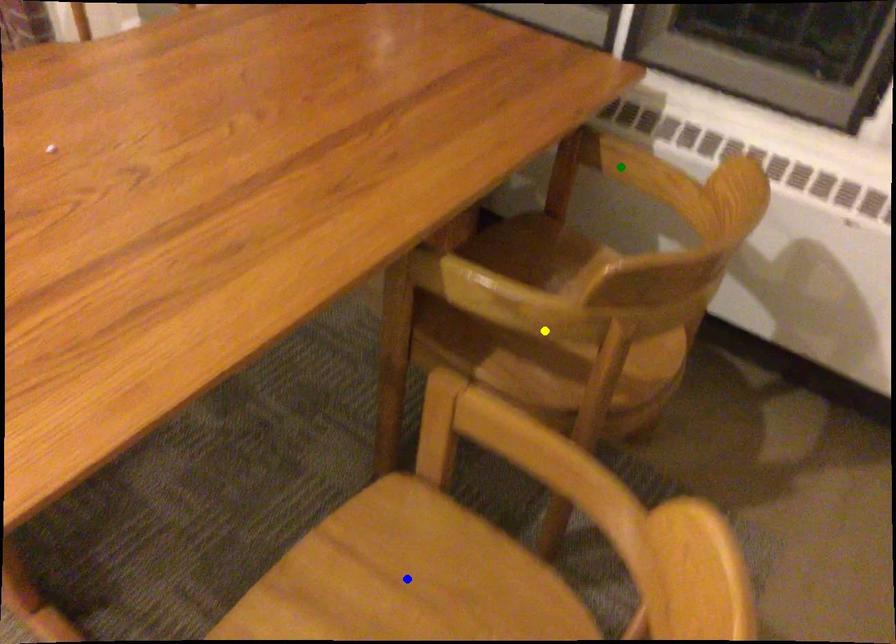
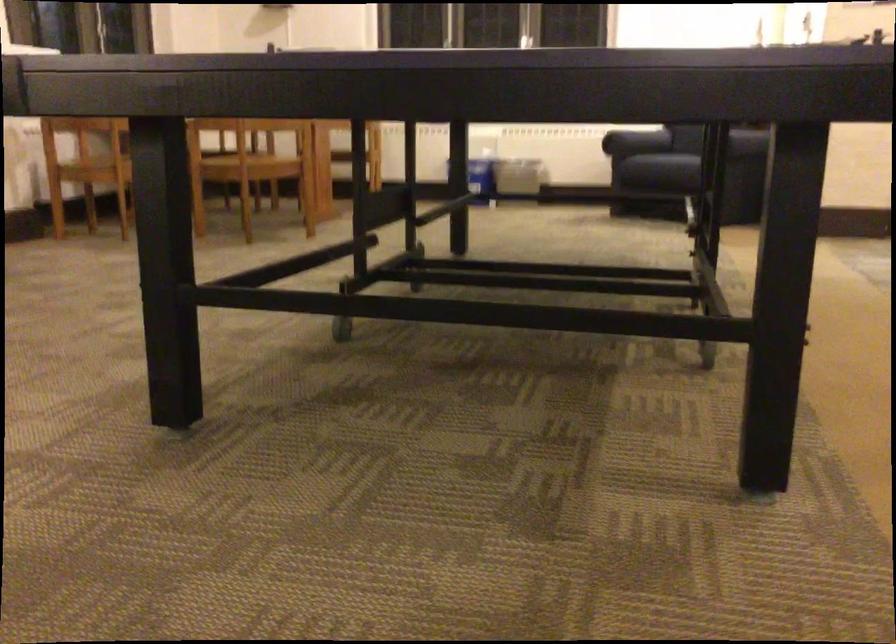
I am providing you with two images of the same scene from different viewpoints. Three points are marked in image1. Which point corresponds to a part or object that is occluded in image2?In image1, three points are marked. Which of them correspond to a part or object that is occluded in image2?Among the three points shown in image1, which one corresponds to a part or object that is no longer visible due to occlusion in image2?

yellow point, green point, blue point cannot be seen in image2.